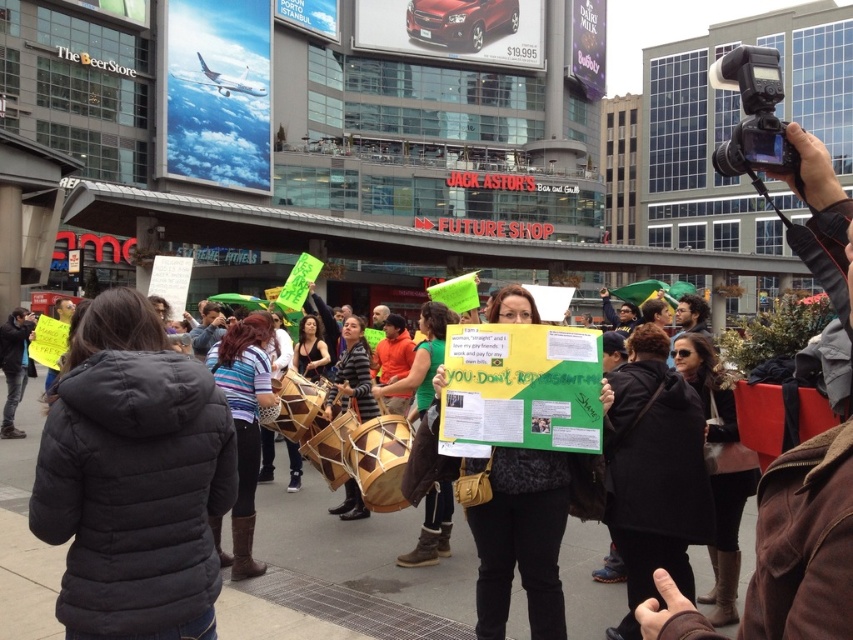
Question: Which point is farther from the camera taking this photo?

Choices:
 (A) (482, 550)
 (B) (755, 141)

Answer: (A)

Question: From the image, what is the correct spatial relationship of green paper sign at center in relation to black plastic camera at upper right?

Choices:
 (A) right
 (B) left

Answer: (B)

Question: Is green paper sign at center smaller than black plastic camera at upper right?

Choices:
 (A) yes
 (B) no

Answer: (A)

Question: Does green paper sign at center have a lesser width compared to black plastic camera at upper right?

Choices:
 (A) yes
 (B) no

Answer: (A)